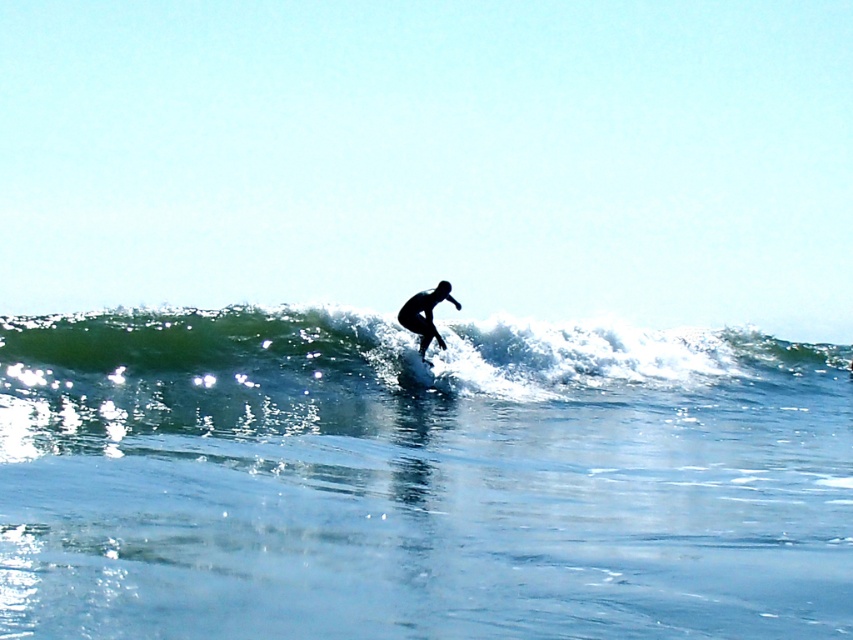
Can you confirm if green rubber wave at center is thinner than black matte surfboard at center?

No.

Who is more forward, (202, 380) or (421, 305)?

Positioned in front is point (202, 380).

The image size is (853, 640). Find the location of `green rubber wave at center`. green rubber wave at center is located at coordinates [x=393, y=352].

Who is lower down, clear blue water at wave center or black matte surfboard at center?

clear blue water at wave center is below.

Can you confirm if clear blue water at wave center is bigger than black matte surfboard at center?

Yes, clear blue water at wave center is bigger than black matte surfboard at center.

You are a GUI agent. You are given a task and a screenshot of the screen. Output one action in this format:
    pyautogui.click(x=<x>, y=<y>)
    Task: Click on the clear blue water at wave center
    The image size is (853, 640).
    Given the screenshot: What is the action you would take?
    pyautogui.click(x=418, y=477)

Does clear blue water at wave center have a greater width compared to green rubber wave at center?

No.

You are a GUI agent. You are given a task and a screenshot of the screen. Output one action in this format:
    pyautogui.click(x=<x>, y=<y>)
    Task: Click on the clear blue water at wave center
    The width and height of the screenshot is (853, 640).
    Given the screenshot: What is the action you would take?
    pyautogui.click(x=418, y=477)

Locate an element on the screen. The height and width of the screenshot is (640, 853). clear blue water at wave center is located at coordinates (418, 477).